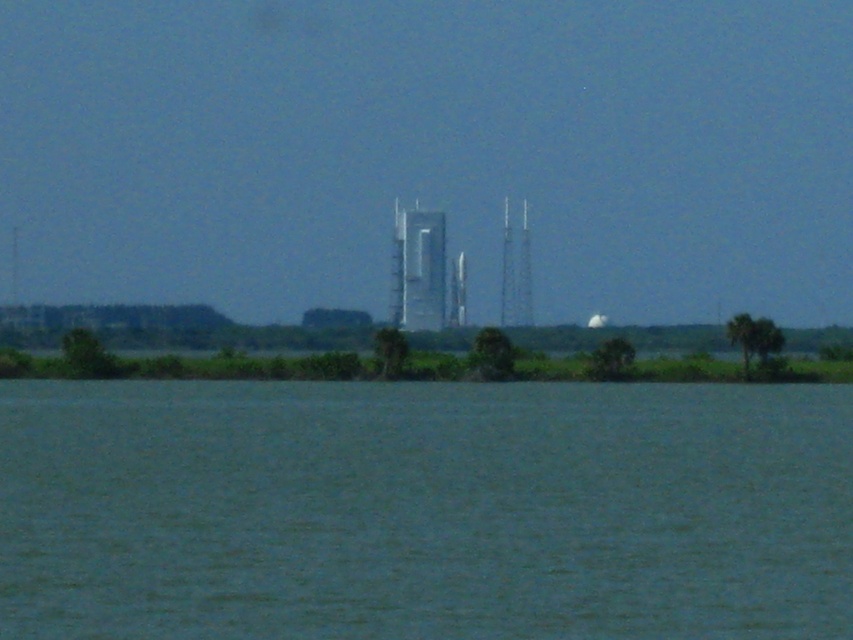
Question: Which point is closer to the camera?

Choices:
 (A) metallic silver tower at center
 (B) smooth silver tower at center
 (C) shiny metallic rocket at center

Answer: (A)

Question: Does blue water at center appear on the left side of smooth silver tower at center?

Choices:
 (A) no
 (B) yes

Answer: (B)

Question: Is smooth silver tower at center below shiny metallic rocket at center?

Choices:
 (A) yes
 (B) no

Answer: (B)

Question: Which point is closer to the camera taking this photo?

Choices:
 (A) (399, 304)
 (B) (505, 250)
 (C) (457, 289)

Answer: (A)

Question: Which object appears closest to the camera in this image?

Choices:
 (A) smooth silver tower at center
 (B) metallic silver tower at center
 (C) shiny metallic rocket at center
 (D) blue water at center

Answer: (D)

Question: Does blue water at center have a smaller size compared to shiny metallic rocket at center?

Choices:
 (A) yes
 (B) no

Answer: (B)